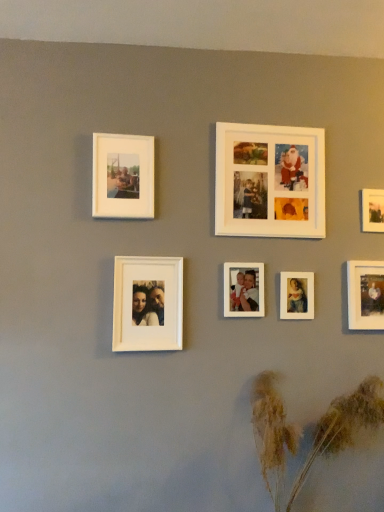
Question: From a real-world perspective, relative to matte white photo frame at upper right, the 1th picture frame from the right, is matte white photo frame at center right, which is the 5th picture frame in left-to-right order, vertically above or below?

Choices:
 (A) below
 (B) above

Answer: (A)

Question: Is point (284, 284) closer or farther from the camera than point (375, 225)?

Choices:
 (A) farther
 (B) closer

Answer: (B)

Question: Which object is the closest to the white matte photo frame at upper center, arranged as the fourth picture frame when viewed from the right?

Choices:
 (A) matte white photo frame at center right, which is the 5th picture frame in left-to-right order
 (B) matte white photo frame at lower right, the 6th picture frame from the left
 (C) brown textured plant at lower right
 (D) white matte photo frame at upper left, the first picture frame positioned from the left
 (E) white matte photo frame at center, placed as the fifth picture frame when sorted from right to left

Answer: (E)

Question: Which of these objects is positioned closest to the matte white photo frame at center right, the third picture frame viewed from the right?

Choices:
 (A) white matte photo frame at center, placed as the fifth picture frame when sorted from right to left
 (B) white matte photo frame at upper center, arranged as the fourth picture frame when viewed from the left
 (C) white matte photo frame at upper left, the first picture frame positioned from the left
 (D) white matte photo frame at center, the sixth picture frame from the right
 (E) matte white photo frame at upper right, the 1th picture frame from the right

Answer: (A)